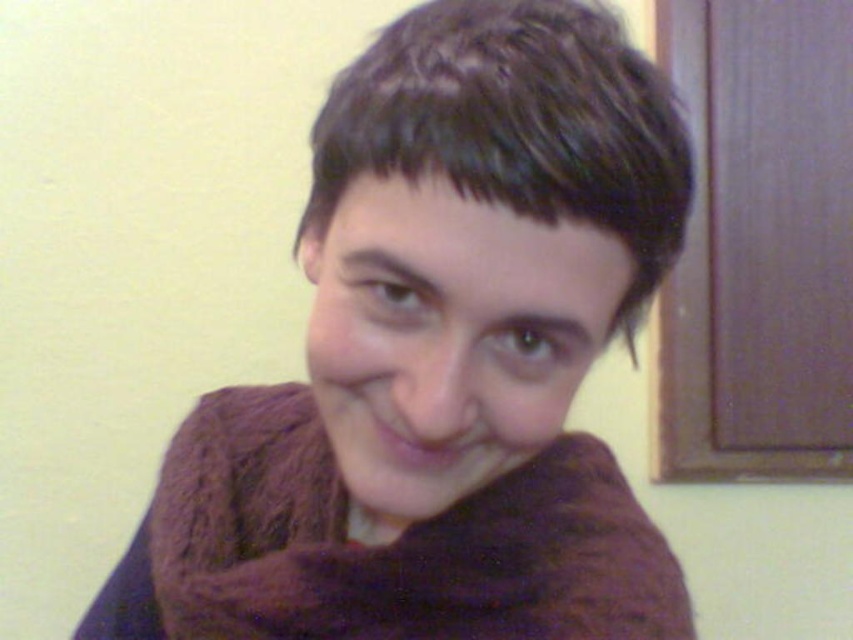
You are an interior designer planning to place a purple knitted scarf at center and a brown fuzzy scarf at center on a small shelf. Given their sizes, which scarf will take up more space on the shelf?

The purple knitted scarf at center is bigger than the brown fuzzy scarf at center, so it will take up more space on the shelf.

You are a fashion stylist trying to layer two scarves for a client. You have a purple knitted scarf at center and a brown fuzzy scarf at center. According to the image, which scarf should be worn on top to follow the layering shown?

The purple knitted scarf at center is in front of the brown fuzzy scarf at center, so it should be worn on top to match the layering shown.

You are an interior designer arranging two scarves on a display stand. The purple knitted scarf at center and the brown fuzzy scarf at center are placed side by side. Which scarf should you move to the right side to align with the original image?

The purple knitted scarf at center should be moved to the right side because in the original image, the purple knitted scarf at center is to the right of the brown fuzzy scarf at center.